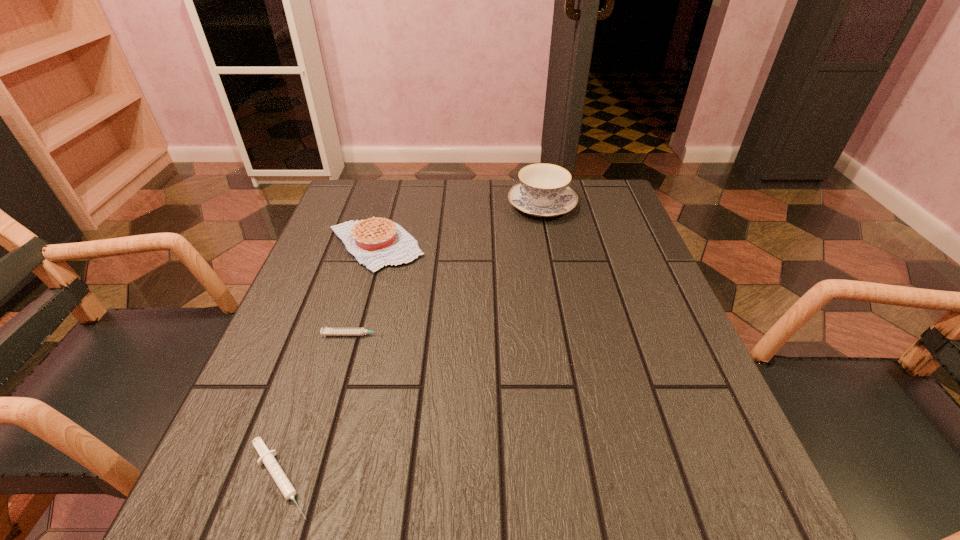
You are a GUI agent. You are given a task and a screenshot of the screen. Output one action in this format:
    pyautogui.click(x=<x>, y=<y>)
    Task: Click on the object that is at the near edge
    This screenshot has width=960, height=540.
    Given the screenshot: What is the action you would take?
    pyautogui.click(x=267, y=458)

The height and width of the screenshot is (540, 960). Find the location of `pie at the left edge`. pie at the left edge is located at coordinates (375, 242).

I want to click on object situated at the right edge, so click(x=543, y=191).

You are a GUI agent. You are given a task and a screenshot of the screen. Output one action in this format:
    pyautogui.click(x=<x>, y=<y>)
    Task: Click on the object at the far left corner
    The width and height of the screenshot is (960, 540).
    Given the screenshot: What is the action you would take?
    pyautogui.click(x=375, y=242)

What are the coordinates of `object present at the near left corner` in the screenshot? It's located at (267, 458).

At what (x,y) coordinates should I click in order to perform the action: click on object that is positioned at the far right corner. Please return your answer as a coordinate pair (x, y). This screenshot has height=540, width=960. Looking at the image, I should click on (543, 191).

In the image, there is a desktop. Where is `vacant area at the far edge`? The height and width of the screenshot is (540, 960). vacant area at the far edge is located at coordinates (498, 193).

Identify the location of vacant space at the near edge of the desktop. The width and height of the screenshot is (960, 540). (355, 522).

Locate an element on the screen. Image resolution: width=960 pixels, height=540 pixels. blank space at the left edge of the desktop is located at coordinates (292, 389).

Identify the location of vacant space at the right edge of the desktop. The width and height of the screenshot is (960, 540). (601, 301).